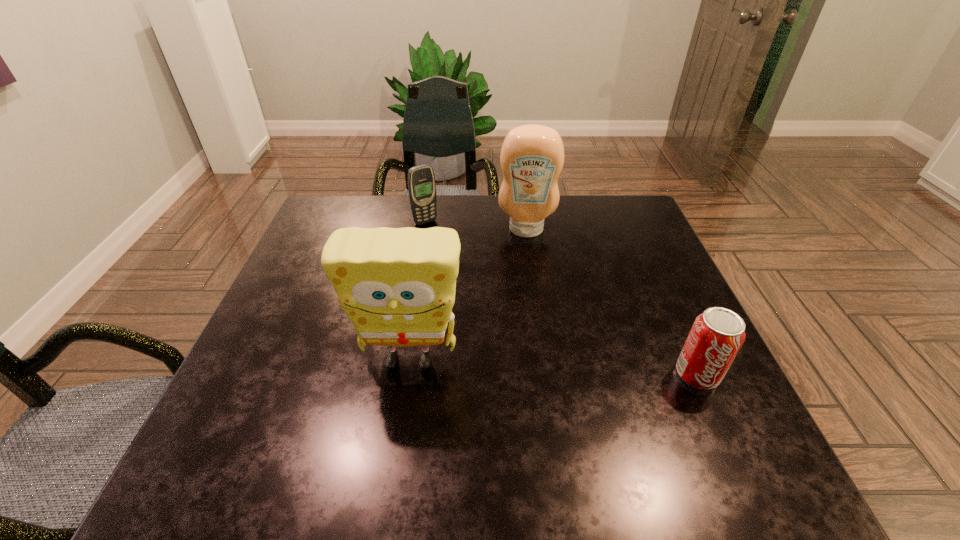
This screenshot has height=540, width=960. I want to click on sponge, so 397,285.

This screenshot has height=540, width=960. I want to click on the shortest object, so click(717, 334).

At what (x,y) coordinates should I click in order to perform the action: click on soda can. Please return your answer as a coordinate pair (x, y). Image resolution: width=960 pixels, height=540 pixels. Looking at the image, I should click on (717, 334).

This screenshot has height=540, width=960. I want to click on cellular telephone, so coord(421,181).

Where is `condiment`? condiment is located at coordinates (532, 156).

Where is `vacant space located 0.050m on the face of the sponge`? vacant space located 0.050m on the face of the sponge is located at coordinates (402, 409).

I want to click on vacant space located on the left of the rightmost object, so click(614, 374).

Identify the location of free region located 0.050m on the screen of the cellular telephone. The height and width of the screenshot is (540, 960). (439, 235).

You are a GUI agent. You are given a task and a screenshot of the screen. Output one action in this format:
    pyautogui.click(x=<x>, y=<y>)
    Task: Click on the free point located on the screen of the cellular telephone
    The width and height of the screenshot is (960, 540).
    Given the screenshot: What is the action you would take?
    pyautogui.click(x=458, y=259)

Identify the location of free spot located on the screen of the cellular telephone. The width and height of the screenshot is (960, 540). (478, 284).